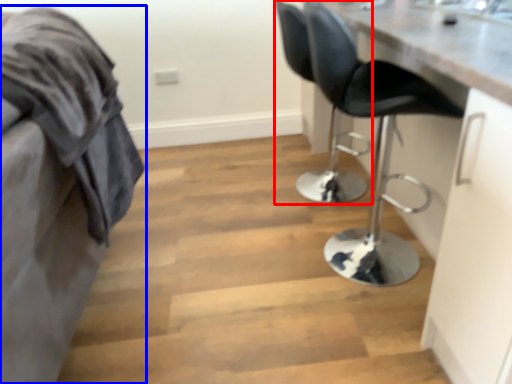
Question: Which of the following is the farthest to the observer, chair (highlighted by a red box) or furniture (highlighted by a blue box)?

Choices:
 (A) chair
 (B) furniture

Answer: (A)